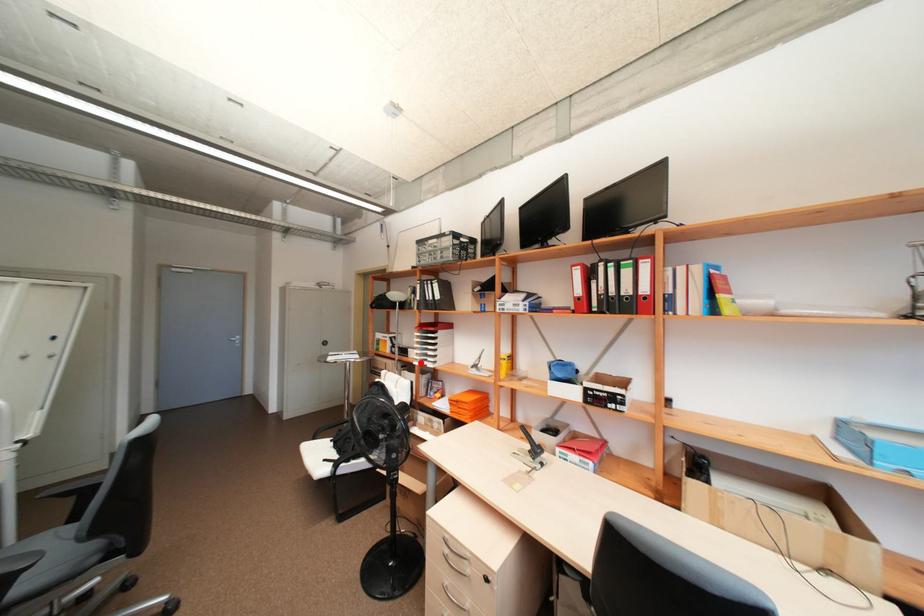
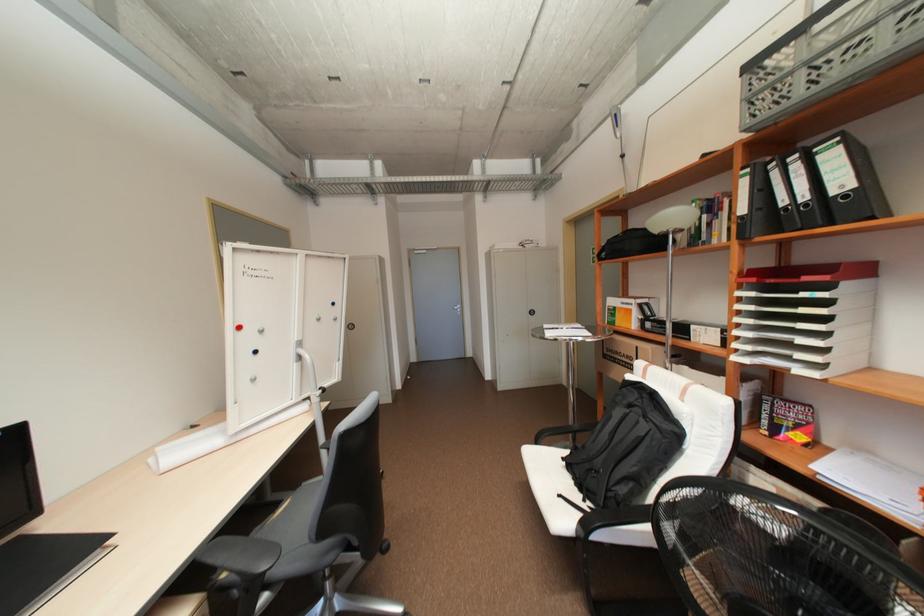
In the second image, find the point that corresponds to the highlighted location in the first image.

(742, 358)